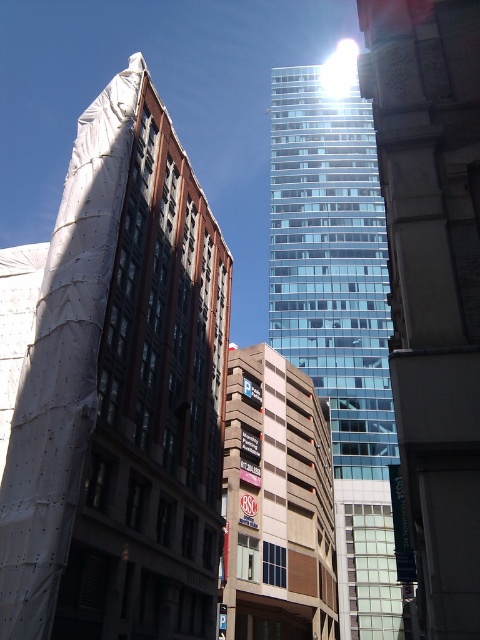
You are a city planner reviewing this area. You need to determine the spatial relationship between the white plastic building at left and the transparent glass building at center. Which one is positioned lower in the image?

The white plastic building at left is located below the transparent glass building at center, so it is positioned lower in the image.

You are a drone operator who needs to fly a drone from the white plastic building at left to the brown brick building at center. Based on the scene, will the drone have an unobstructed path between these two buildings?

The white plastic building at left is in front of the brown brick building at center, so the drone might have an unobstructed path as long as there are no other obstacles between them. However, the description does not mention any other potential obstructions, so we can assume the path is clear.